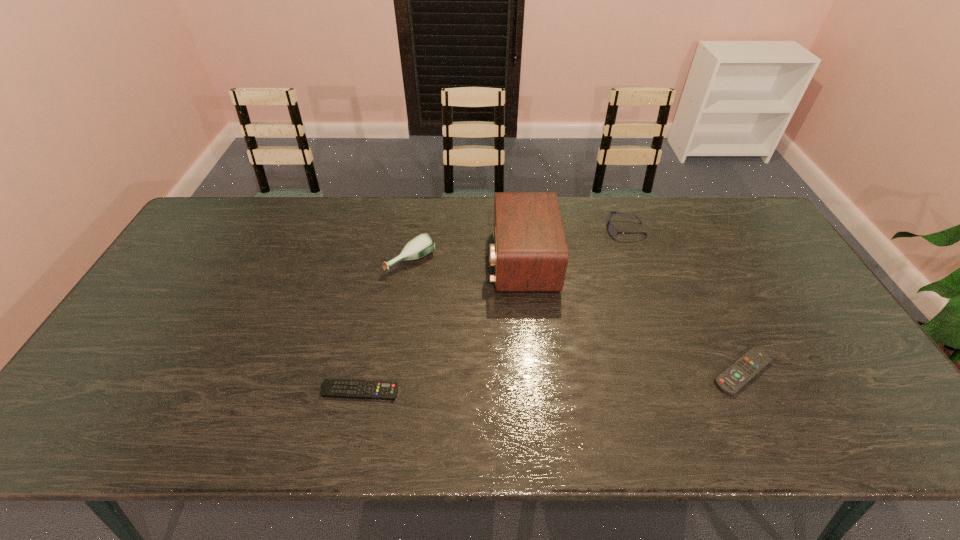
What are the coordinates of `vacant space located on the left of the bottle` in the screenshot? It's located at (338, 260).

The height and width of the screenshot is (540, 960). What are the coordinates of `vacant space located on the lenses of the sunglasses` in the screenshot? It's located at (586, 230).

Locate an element on the screen. The height and width of the screenshot is (540, 960). free space located on the lenses of the sunglasses is located at coordinates (546, 230).

Identify the location of free space located on the lenses of the sunglasses. [x=492, y=230].

The width and height of the screenshot is (960, 540). Find the location of `free location located 0.290m on the left of the rightmost object`. free location located 0.290m on the left of the rightmost object is located at coordinates (592, 372).

Find the location of `blank space located on the back of the left remote control`. blank space located on the back of the left remote control is located at coordinates (379, 295).

Where is `radio receiver that is positioned at the far edge`? The height and width of the screenshot is (540, 960). radio receiver that is positioned at the far edge is located at coordinates (530, 253).

Where is `sunglasses that is at the far edge`? The image size is (960, 540). sunglasses that is at the far edge is located at coordinates (612, 230).

In the image, there is a desktop. What are the coordinates of `vacant region at the far edge` in the screenshot? It's located at (376, 230).

In the image, there is a desktop. At what (x,y) coordinates should I click in order to perform the action: click on blank space at the near edge. Please return your answer as a coordinate pair (x, y). The height and width of the screenshot is (540, 960). Looking at the image, I should click on (628, 440).